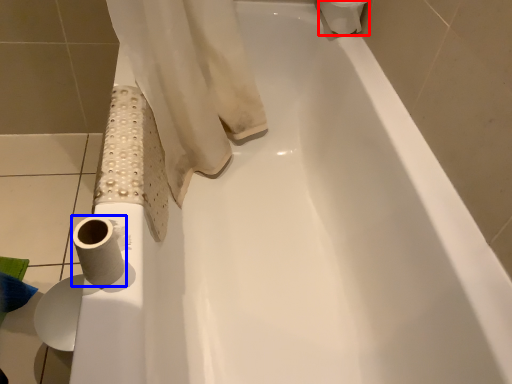
Question: Which object is further to the camera taking this photo, toilet paper (highlighted by a red box) or toilet paper (highlighted by a blue box)?

Choices:
 (A) toilet paper
 (B) toilet paper

Answer: (A)